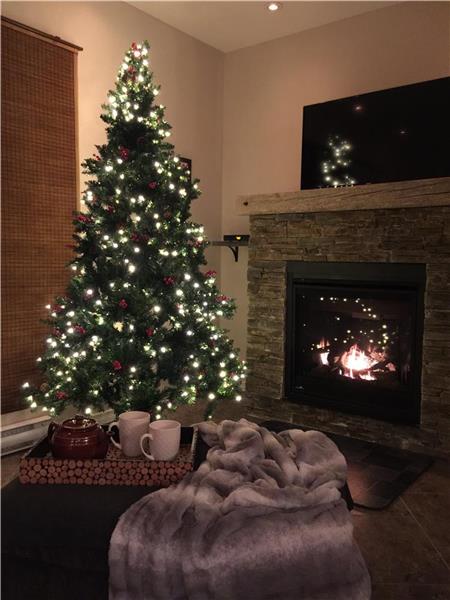
You are a GUI agent. You are given a task and a screenshot of the screen. Output one action in this format:
    pyautogui.click(x=<x>, y=<y>)
    Task: Click on the floor
    This screenshot has height=600, width=450.
    Given the screenshot: What is the action you would take?
    pyautogui.click(x=410, y=558)